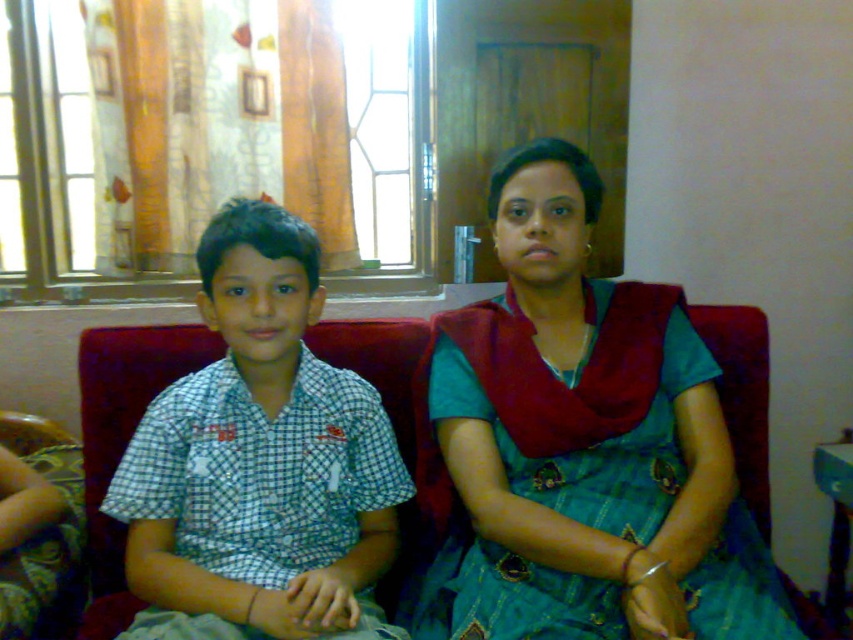
Question: Which object is closer to the camera taking this photo?

Choices:
 (A) teal silk saree at center
 (B) red fabric couch at center
 (C) checkered fabric shirt at left

Answer: (A)

Question: Considering the relative positions of teal silk saree at center and checkered fabric shirt at left in the image provided, where is teal silk saree at center located with respect to checkered fabric shirt at left?

Choices:
 (A) right
 (B) left

Answer: (A)

Question: Among these objects, which one is nearest to the camera?

Choices:
 (A) teal silk saree at center
 (B) checkered fabric shirt at left
 (C) red fabric couch at center

Answer: (A)

Question: Is teal silk saree at center below red fabric couch at center?

Choices:
 (A) no
 (B) yes

Answer: (A)

Question: Which of the following is the farthest from the observer?

Choices:
 (A) (135, 563)
 (B) (474, 408)

Answer: (B)

Question: Does checkered fabric shirt at left have a smaller size compared to red fabric couch at center?

Choices:
 (A) no
 (B) yes

Answer: (B)